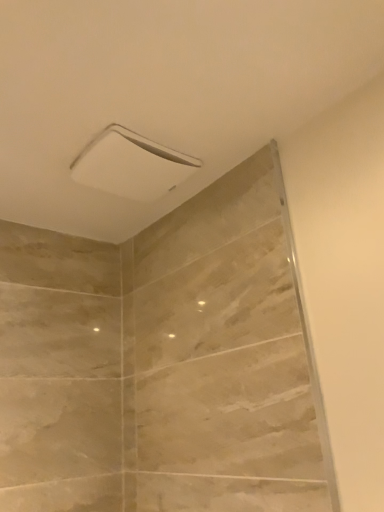
In order to face white matte shower head at upper center, should I rotate leftwards or rightwards?

You should rotate left by 7.692 degrees.

Where is `white matte shower head at upper center`? white matte shower head at upper center is located at coordinates (131, 165).

The height and width of the screenshot is (512, 384). What do you see at coordinates (131, 165) in the screenshot? I see `white matte shower head at upper center` at bounding box center [131, 165].

At what (x,y) coordinates should I click in order to perform the action: click on white matte shower head at upper center. Please return your answer as a coordinate pair (x, y). The width and height of the screenshot is (384, 512). Looking at the image, I should click on pos(131,165).